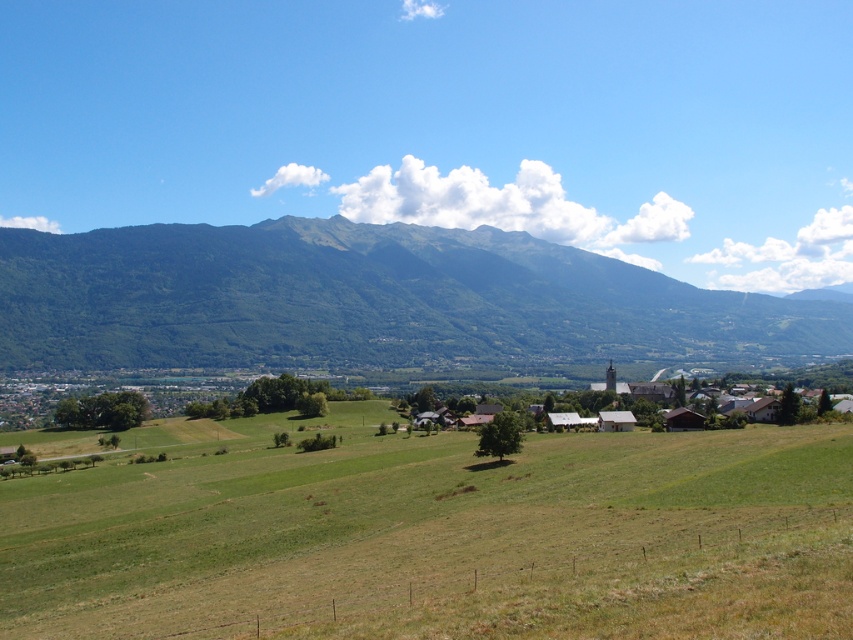
You are standing at the point marked as point (442, 538) in the image. What is the name of the object you are currently standing on?

You are standing on the green grassy field at center, as the green grassy field at center is located at point (442, 538).

You are a hiker standing at the edge of the green grassy field at center and want to reach the green forested mountain at center. Which direction should you walk to get closer to the mountain?

The green grassy field at center has a lesser width compared to green forested mountain at center, so you should walk towards the direction where the mountain is wider to reach it.